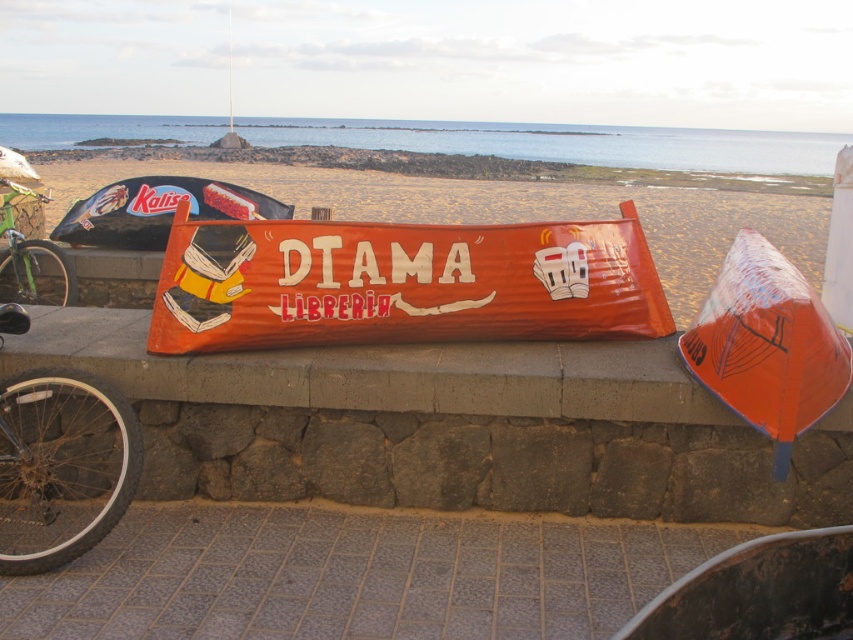
You are standing in front of the stone wall and want to place a new small plant pot between the orange corrugated sign at center and the green matte bicycle at left. Based on their current positions, which object should the plant pot be closer to?

The orange corrugated sign at center is positioned on the right side of green matte bicycle at left, so the plant pot should be placed closer to the green matte bicycle at left since it is to the left of the sign.

You are a delivery person trying to park your green matte bicycle at left near the orange corrugated cardboard sign at center. Based on their positions, can you park the bicycle directly to the left of the sign?

The orange corrugated cardboard sign at center is already to the right of the green matte bicycle at left, so the bicycle is already positioned to the left of the sign. Therefore, you can park the bicycle there as it is already in the correct position.

You are a delivery person with a box that is 30 centimeters wide. You need to place it between the orange corrugated cardboard sign at center and the concrete ledge at center. Is there enough space?

The orange corrugated cardboard sign at center is 27.42 centimeters away from the concrete ledge at center. Since the box is 30 centimeters wide, it will not fit in the space between them.